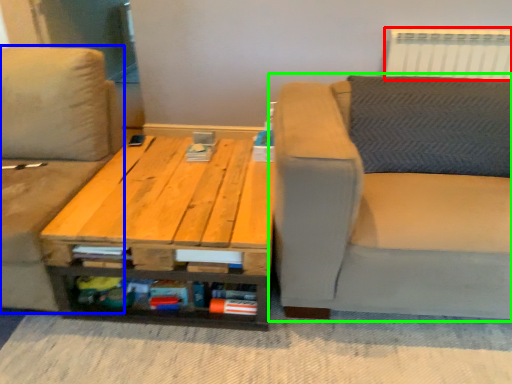
Question: Considering the real-world distances, which object is closest to radiator (highlighted by a red box)? studio couch (highlighted by a blue box) or studio couch (highlighted by a green box).

Choices:
 (A) studio couch
 (B) studio couch

Answer: (B)